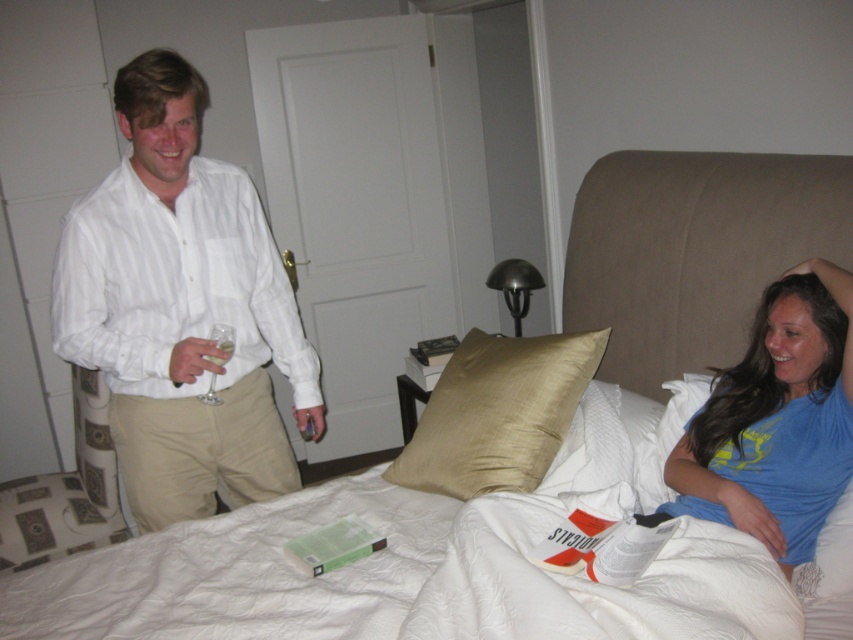
Which is below, white striped shirt at left or khaki cotton pants at left?

khaki cotton pants at left

Is point (161, 124) positioned in front of point (149, 477)?

Yes, it is.

The height and width of the screenshot is (640, 853). Find the location of `white striped shirt at left`. white striped shirt at left is located at coordinates (183, 310).

You are a GUI agent. You are given a task and a screenshot of the screen. Output one action in this format:
    pyautogui.click(x=<x>, y=<y>)
    Task: Click on the white striped shirt at left
    This screenshot has height=640, width=853.
    Given the screenshot: What is the action you would take?
    pyautogui.click(x=183, y=310)

Can you confirm if blue cotton shirt at upper right is positioned to the left of silky gold pillow at center?

No, blue cotton shirt at upper right is not to the left of silky gold pillow at center.

Does point (756, 486) come in front of point (514, 435)?

Yes, point (756, 486) is in front of point (514, 435).

Is point (734, 515) behind point (438, 456)?

No.

The width and height of the screenshot is (853, 640). Find the location of `blue cotton shirt at upper right`. blue cotton shirt at upper right is located at coordinates (776, 420).

Between white striped shirt at left and blue cotton shirt at upper right, which one appears on the right side from the viewer's perspective?

blue cotton shirt at upper right is more to the right.

Does point (280, 362) lie behind point (805, 550)?

That is True.

Where is `white striped shirt at left`? Image resolution: width=853 pixels, height=640 pixels. white striped shirt at left is located at coordinates (183, 310).

At what (x,y) coordinates should I click in order to perform the action: click on white striped shirt at left. Please return your answer as a coordinate pair (x, y). Looking at the image, I should click on (183, 310).